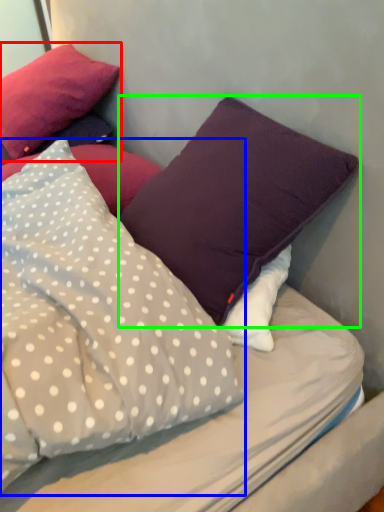
Question: Considering the real-world distances, which object is farthest from pillow (highlighted by a red box)? pillow (highlighted by a blue box) or pillow (highlighted by a green box)?

Choices:
 (A) pillow
 (B) pillow

Answer: (B)